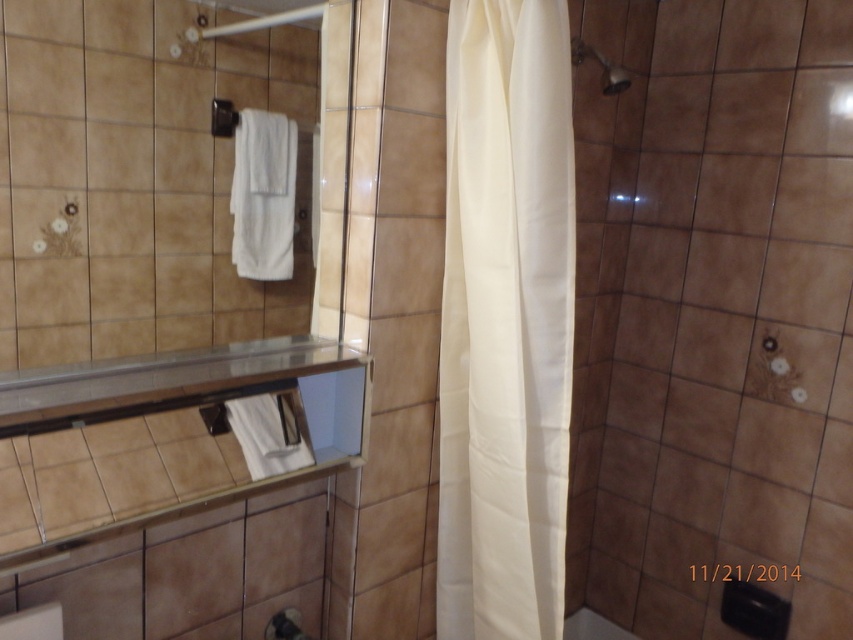
Question: Which of the following is the closest to the observer?

Choices:
 (A) (548, 552)
 (B) (630, 84)

Answer: (A)

Question: Which object appears closest to the camera in this image?

Choices:
 (A) matte silver shower head at upper right
 (B) white fabric shower curtain at center

Answer: (B)

Question: Observing the image, what is the correct spatial positioning of white fabric shower curtain at center in reference to matte silver shower head at upper right?

Choices:
 (A) right
 (B) left

Answer: (B)

Question: Is white fabric shower curtain at center to the right of matte silver shower head at upper right from the viewer's perspective?

Choices:
 (A) no
 (B) yes

Answer: (A)

Question: Is white fabric shower curtain at center to the right of matte silver shower head at upper right from the viewer's perspective?

Choices:
 (A) yes
 (B) no

Answer: (B)